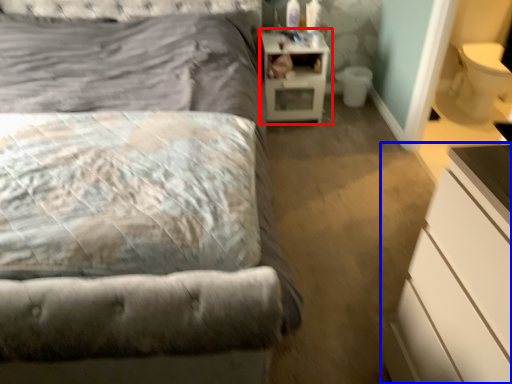
Question: Which point is closer to the camera, nightstand (highlighted by a red box) or chest of drawers (highlighted by a blue box)?

Choices:
 (A) nightstand
 (B) chest of drawers

Answer: (B)